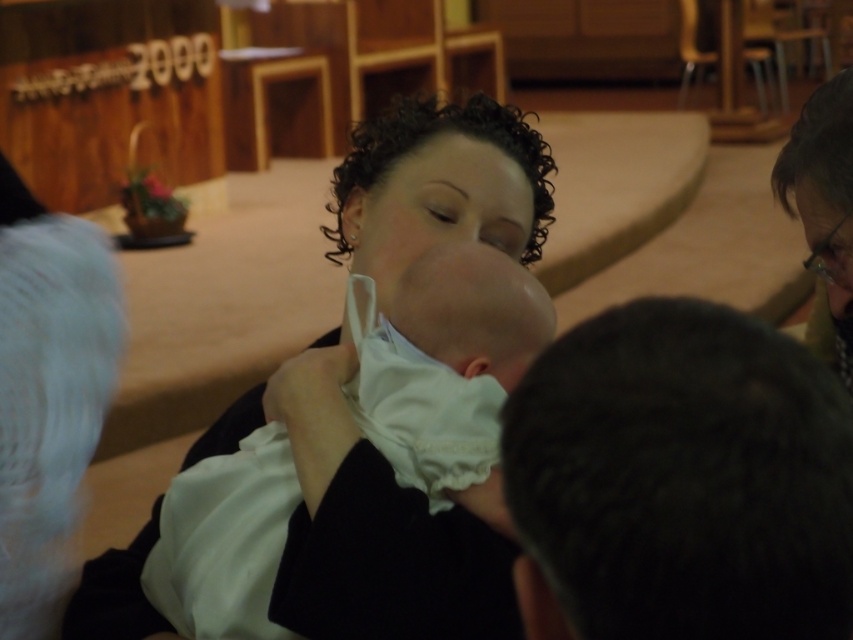
You are standing in the church scene described. The dark hair at lower right and the white clothed baby at center are both in view. Which object is positioned to the right of the other?

The dark hair at lower right is positioned to the right of the white clothed baby at center.

In the church scene, there is a woman with curly dark hair and a baby. There is also a point marked at coordinates (683, 476). What is located at this point?

The point at (683, 476) marks the dark hair at lower right.